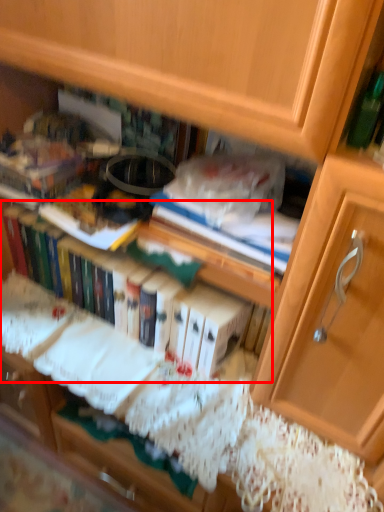
Question: Where is book (annotated by the red box) located in relation to paperback book in the image?

Choices:
 (A) left
 (B) right

Answer: (A)